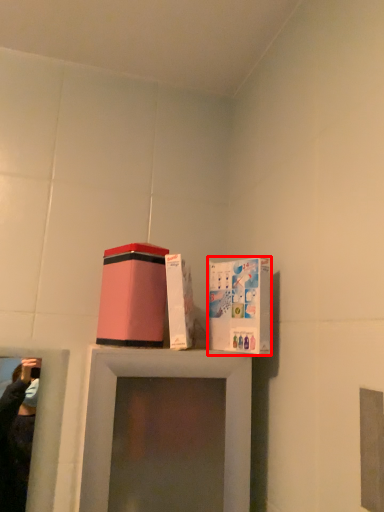
Question: In this image, where is cardboard box (annotated by the red box) located relative to box?

Choices:
 (A) left
 (B) right

Answer: (B)